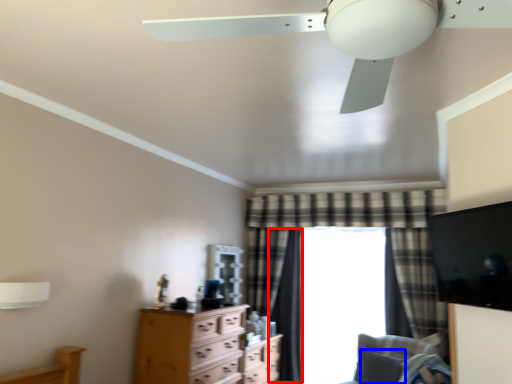
Question: Among these objects, which one is farthest to the camera, curtain (highlighted by a red box) or pillow (highlighted by a blue box)?

Choices:
 (A) curtain
 (B) pillow

Answer: (A)